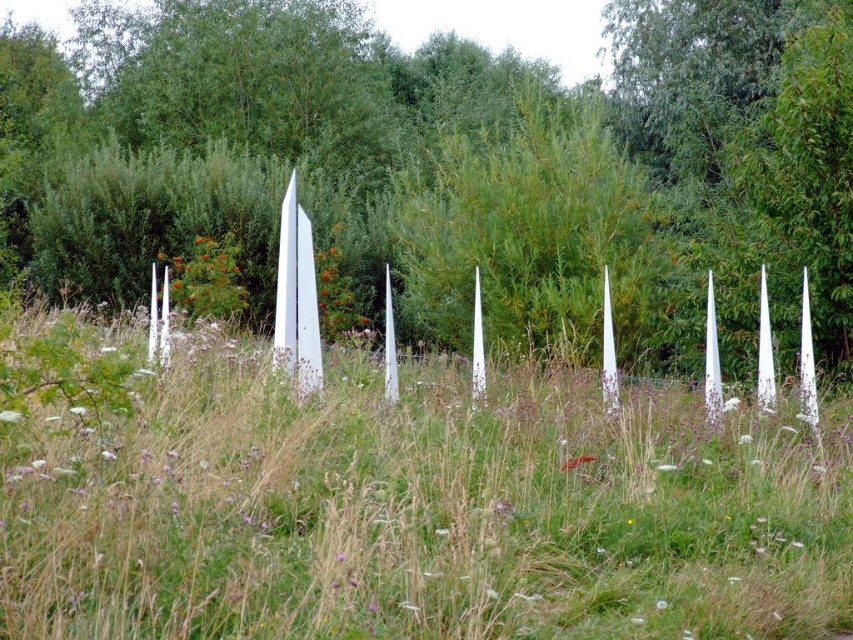
Does green leafy tree at center have a larger size compared to white glossy blade at center?

Indeed, green leafy tree at center has a larger size compared to white glossy blade at center.

Which of these two, green leafy tree at center or white glossy blade at center, stands taller?

With more height is green leafy tree at center.

Does point (241, 20) come in front of point (283, 268)?

No, (241, 20) is further to viewer.

The width and height of the screenshot is (853, 640). In order to click on green leafy tree at center in this screenshot , I will do `click(457, 164)`.

Is green leafy tree at center closer to the viewer compared to green grass at center?

No, it is behind green grass at center.

Between point (28, 264) and point (61, 484), which one is positioned in front?

Positioned in front is point (61, 484).

Is point (177, 26) farther from camera compared to point (633, 580)?

Yes, point (177, 26) is behind point (633, 580).

Find the location of a particular element. This screenshot has width=853, height=640. green leafy tree at center is located at coordinates (457, 164).

Between point (16, 532) and point (280, 280), which one is positioned in front?

Point (16, 532) is more forward.

Find the location of a particular element. green grass at center is located at coordinates (425, 513).

The width and height of the screenshot is (853, 640). What are the coordinates of `green grass at center` in the screenshot? It's located at (425, 513).